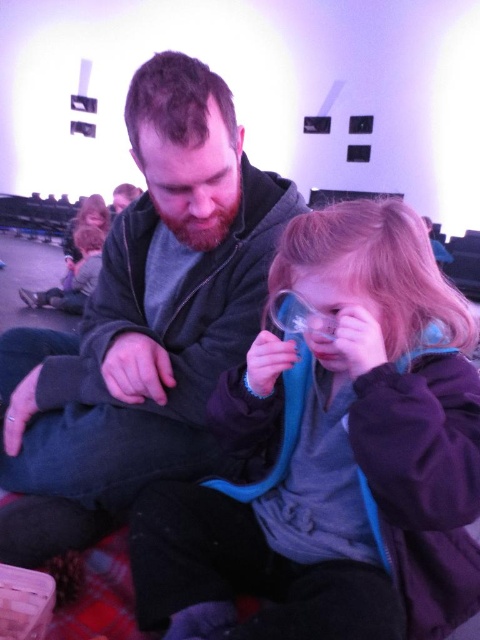
You are a visitor at the museum and you want to try on the transparent plastic goggles at center. There is a purple fleece jacket at center in the way. Can you reach the goggles without moving the jacket?

The purple fleece jacket at center is much taller than transparent plastic goggles at center, so it might block your access to the goggles. You might need to move the jacket to reach them.

You are a visitor at the museum and want to see the transparent plastic goggles at center. The dark gray hoodie at center is blocking your view. Can you move around the hoodie to see the goggles?

The transparent plastic goggles at center is behind dark gray hoodie at center, so you can move around the hoodie to see the goggles.

You are standing in front of an exhibit and see two points marked on the display. The first point is at coordinates point (325, 634) and the second is at point (280, 321). Which point is closer to you?

Point (325, 634) is closer to the viewer than point (280, 321).